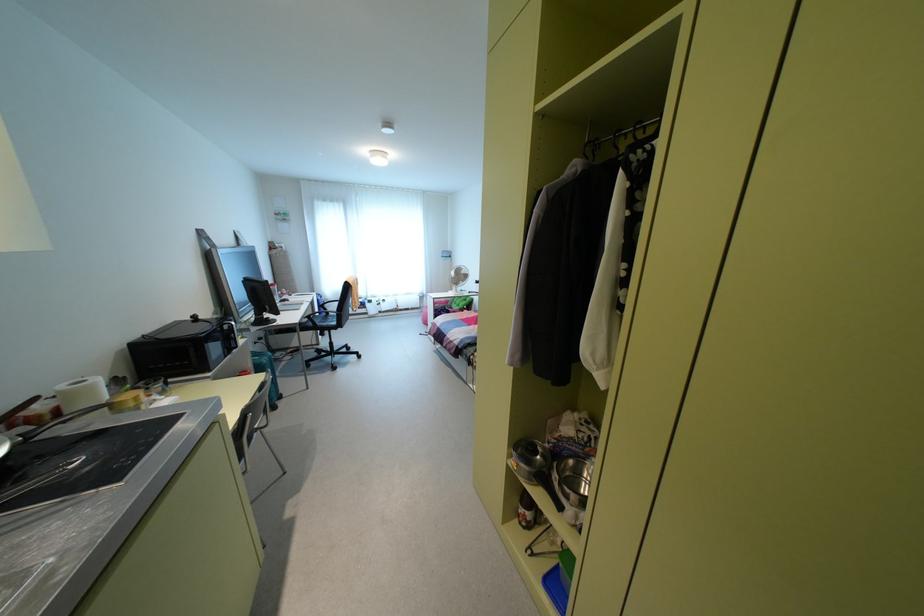
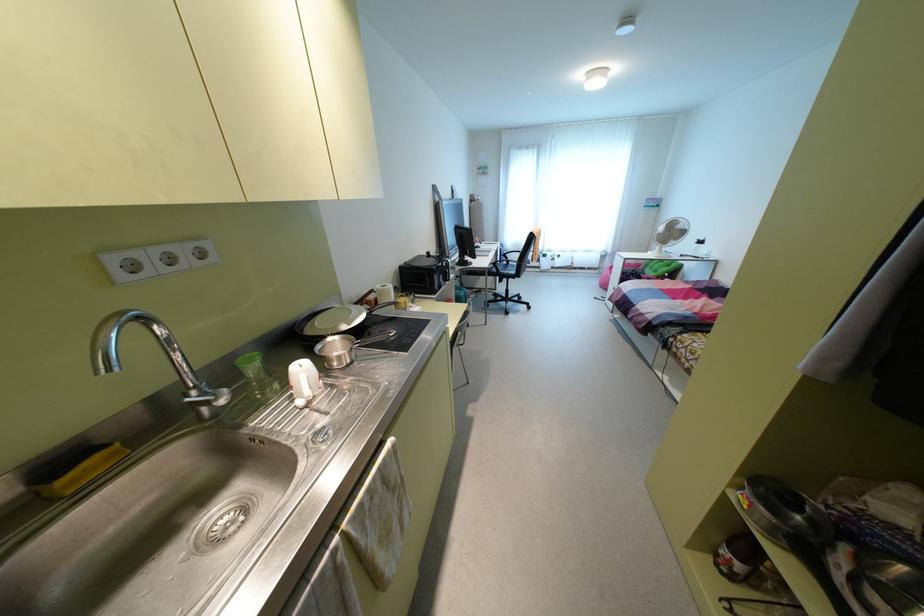
Find the pixel in the second image that matches pixel 463 270 in the first image.

(679, 225)